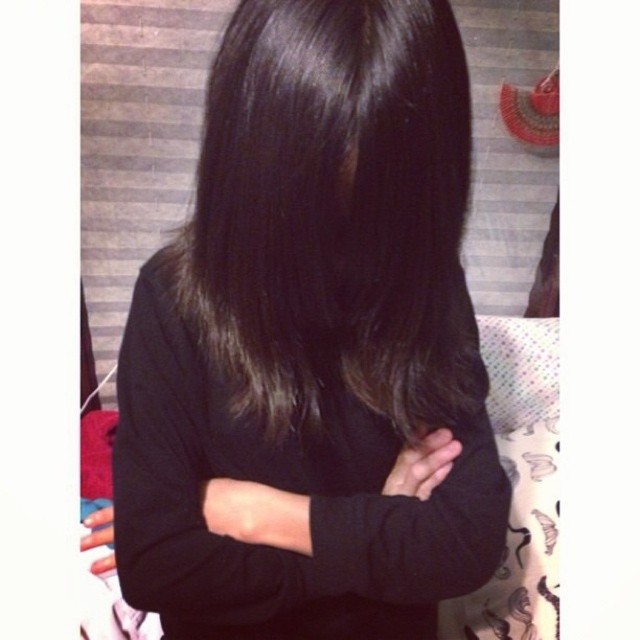
From the picture: You are a photographer standing in front of the person with shiny dark brown hair at center. You want to take a closeup shot of their hair without getting too close. What is the minimum distance you should maintain to ensure the entire hair is in focus?

The minimum distance you should maintain is 17.52 inches from the shiny dark brown hair at center to ensure the entire hair is in focus.

You are an artist trying to sketch the scene. You need to place the shiny dark brown hair at center accurately. According to the coordinates provided, where should you position it on your drawing canvas?

The shiny dark brown hair at center should be positioned at coordinates point 0.334 on the x axis and 0.523 on the y axis.

You are a photographer adjusting the lighting for a portrait. You notice the shiny dark brown hair at center and the black matte sweater at center. Which object would require more careful lighting to avoid glare, and why?

The shiny dark brown hair at center would require more careful lighting to avoid glare because it has a lesser width compared to the black matte sweater at center, making it more prone to reflecting light in a smaller area.